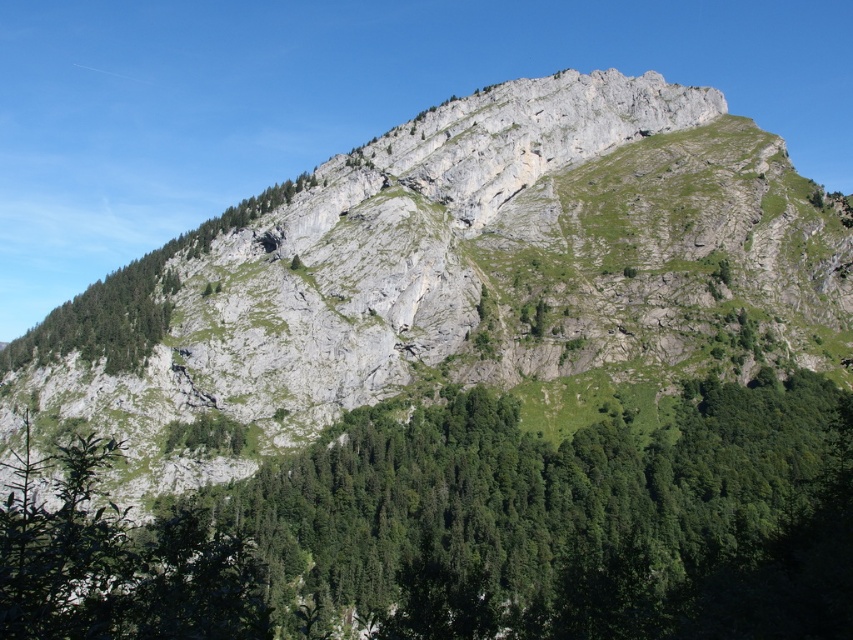
You are a hiker planning to cross between the gray rock mountain at center and the green leafy trees at center. The path between them is narrow. If your backpack is 5 feet wide, can you safely pass through the gap? Please explain.

The gray rock mountain at center and green leafy trees at center are 115.83 feet apart from each other. Since the gap between them is much wider than your 5 feet wide backpack, you can safely pass through the gap.

Based on the scene description, can you determine if the gray rock mountain at center is wider than the green leafy trees at center?

The gray rock mountain at center is wider than green leafy trees at center according to the description provided.